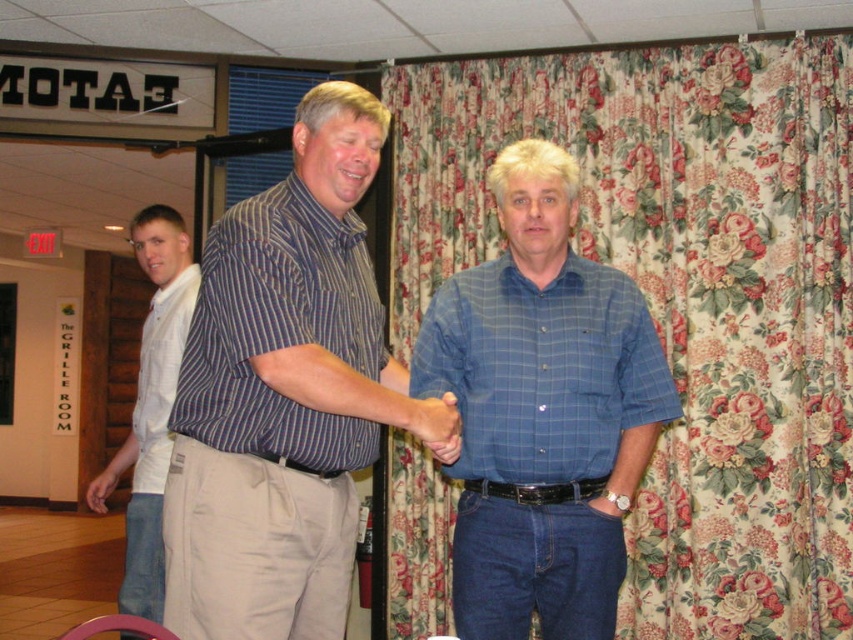
Question: Does striped cotton shirt at center have a larger size compared to blue checkered shirt at center?

Choices:
 (A) no
 (B) yes

Answer: (B)

Question: Does blue checkered shirt at center appear over white cotton shirt at left?

Choices:
 (A) yes
 (B) no

Answer: (A)

Question: From the image, what is the correct spatial relationship of blue checkered shirt at center in relation to white cotton shirt at left?

Choices:
 (A) below
 (B) above

Answer: (B)

Question: Which point is farther to the camera?

Choices:
 (A) blue checkered shirt at center
 (B) floral fabric curtain at right
 (C) white cotton shirt at left
 (D) striped cotton shirt at center

Answer: (B)

Question: Among these objects, which one is nearest to the camera?

Choices:
 (A) striped cotton shirt at center
 (B) floral fabric curtain at right
 (C) blue checkered shirt at center
 (D) white cotton shirt at left

Answer: (A)

Question: Based on their relative distances, which object is farther from the blue checkered shirt at center?

Choices:
 (A) white cotton shirt at left
 (B) striped cotton shirt at center
 (C) floral fabric curtain at right

Answer: (C)